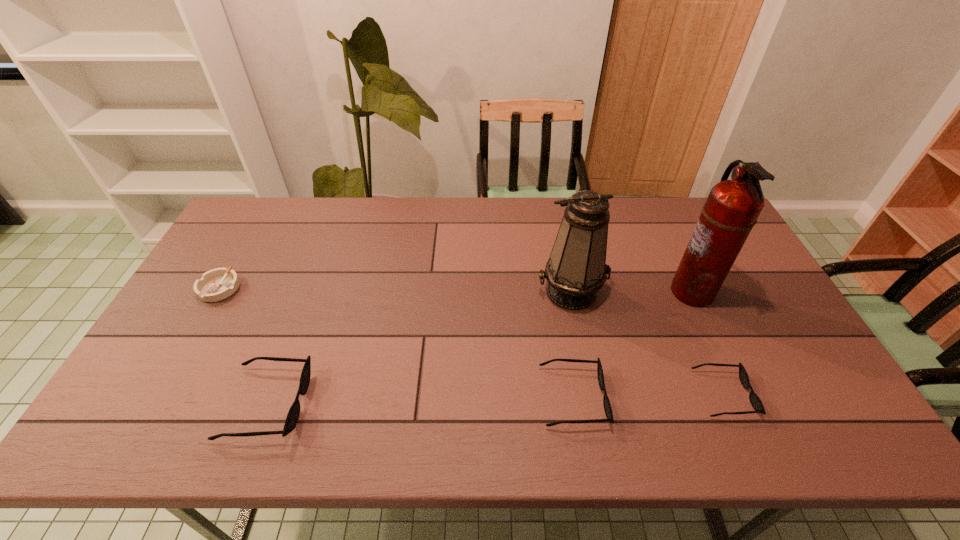
I want to click on empty location between the third shortest object and the leftmost sunglasses, so pos(420,400).

I want to click on free space that is in between the leftmost object and the second shortest sunglasses, so click(x=396, y=342).

Identify which object is the fifth nearest to the second object from left to right. Please provide its 2D coordinates. Your answer should be formatted as a tuple, i.e. [(x, y)], where the tuple contains the x and y coordinates of a point satisfying the conditions above.

[(732, 208)]

Identify the location of object that ranks as the second closest to the tallest object. (576, 269).

Identify which sunglasses is the second nearest to the second tallest object. Please provide its 2D coordinates. Your answer should be formatted as a tuple, i.e. [(x, y)], where the tuple contains the x and y coordinates of a point satisfying the conditions above.

[(755, 401)]

Locate an element on the screen. The image size is (960, 540). sunglasses that is the second closest to the leftmost sunglasses is located at coordinates (755, 401).